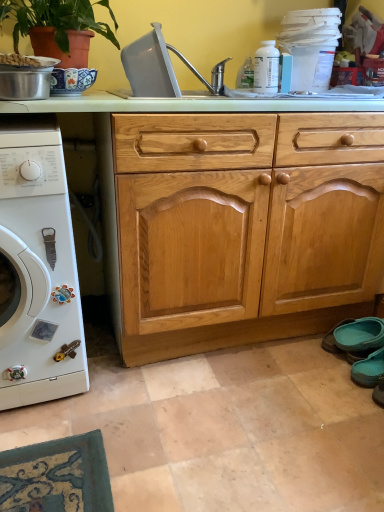
Identify the location of gray plastic sink at upper center. (211, 73).

What is the approximate height of gray plastic sink at upper center?

It is 9.87 inches.

Describe the element at coordinates (54, 20) in the screenshot. The image size is (384, 512). I see `terracotta clay pot at upper left` at that location.

In order to face metallic silver pot at upper left, should I rotate leftwards or rightwards?

To face it directly, rotate left by 22.132 degrees.

Measure the distance between teal fabric shoe at lower right, which is the 1th shoe in back-to-front order, and camera.

teal fabric shoe at lower right, which is the 1th shoe in back-to-front order, and camera are 1.52 meters apart.

In order to face teal fabric shoe at lower right, which is the 1th shoe in back-to-front order, should I rotate leftwards or rightwards?

Rotate your view right by about 24.064°.

Where is `gray plastic sink at upper center`? This screenshot has height=512, width=384. gray plastic sink at upper center is located at coordinates (211, 73).

From the image's perspective, is gray plastic sink at upper center beneath white matte washing machine at left?

Actually, gray plastic sink at upper center appears above white matte washing machine at left in the image.

Considering the relative sizes of gray plastic sink at upper center and white matte washing machine at left in the image provided, is gray plastic sink at upper center smaller than white matte washing machine at left?

Indeed, gray plastic sink at upper center has a smaller size compared to white matte washing machine at left.

Is gray plastic sink at upper center thinner than white matte washing machine at left?

Indeed, gray plastic sink at upper center has a lesser width compared to white matte washing machine at left.

Could white matte washing machine at left be considered to be inside gray plastic sink at upper center?

That's incorrect, white matte washing machine at left is not inside gray plastic sink at upper center.

Is teal fabric shoe at lower right, which is the 1th shoe in back-to-front order, located within gray plastic sink at upper center?

No, teal fabric shoe at lower right, which is the 1th shoe in back-to-front order, is not a part of gray plastic sink at upper center.

Based on the photo, is gray plastic sink at upper center looking in the opposite direction of teal fabric shoe at lower right, placed as the second shoe when sorted from front to back?

That's not correct — gray plastic sink at upper center is not looking away from teal fabric shoe at lower right, placed as the second shoe when sorted from front to back.

Identify the location of shoe that is the 2nd object located behind the gray plastic sink at upper center. Image resolution: width=384 pixels, height=512 pixels. (360, 334).

From the image's perspective, which is above, gray plastic sink at upper center or teal fabric shoe at lower right, placed as the second shoe when sorted from front to back?

From the image's view, gray plastic sink at upper center is above.

Based on their positions, is white matte washing machine at left located to the left or right of gray plastic sink at upper center?

In the image, white matte washing machine at left appears on the left side of gray plastic sink at upper center.

Can you tell me how much white matte washing machine at left and gray plastic sink at upper center differ in facing direction?

They differ by 0.00116 degrees in their facing directions.

Considering the points (43, 329) and (176, 50), which point is in front, point (43, 329) or point (176, 50)?

The point (43, 329) is closer to the camera.

Is gray plastic sink at upper center turned away from metallic silver pot at upper left?

That's not correct — gray plastic sink at upper center is not looking away from metallic silver pot at upper left.

Who is bigger, gray plastic sink at upper center or metallic silver pot at upper left?

With larger size is gray plastic sink at upper center.

Is the depth of gray plastic sink at upper center greater than that of metallic silver pot at upper left?

Yes.

This screenshot has height=512, width=384. I want to click on appliance that is above the teal fabric slipper at lower right, which is the 2th shoe in back-to-front order (from the image's perspective), so click(25, 77).

From the image's perspective, which is above, teal fabric slipper at lower right, the 1th shoe viewed from the front, or metallic silver pot at upper left?

metallic silver pot at upper left is shown above in the image.

Is teal fabric slipper at lower right, the 1th shoe viewed from the front, taller or shorter than metallic silver pot at upper left?

teal fabric slipper at lower right, the 1th shoe viewed from the front, is taller than metallic silver pot at upper left.

Consider the image. Is teal fabric slipper at lower right, the 1th shoe viewed from the front, positioned beyond the bounds of metallic silver pot at upper left?

That's correct, teal fabric slipper at lower right, the 1th shoe viewed from the front, is outside of metallic silver pot at upper left.

Can you confirm if gray plastic sink at upper center is thinner than teal fabric slipper at lower right, the 1th shoe viewed from the front?

Incorrect, the width of gray plastic sink at upper center is not less than that of teal fabric slipper at lower right, the 1th shoe viewed from the front.

Considering their positions, is gray plastic sink at upper center located in front of or behind teal fabric slipper at lower right, the 1th shoe viewed from the front?

gray plastic sink at upper center is in front of teal fabric slipper at lower right, the 1th shoe viewed from the front.

Is metallic silver pot at upper left located within teal fabric shoe at lower right, placed as the second shoe when sorted from front to back?

Actually, metallic silver pot at upper left is outside teal fabric shoe at lower right, placed as the second shoe when sorted from front to back.

I want to click on appliance on the left of teal fabric shoe at lower right, placed as the second shoe when sorted from front to back, so click(25, 77).

From the image's perspective, which object appears higher, teal fabric shoe at lower right, placed as the second shoe when sorted from front to back, or metallic silver pot at upper left?

From the image's view, metallic silver pot at upper left is above.

Is teal fabric shoe at lower right, which is the 1th shoe in back-to-front order, shorter than metallic silver pot at upper left?

No.

I want to click on sink behind the white matte washing machine at left, so click(x=211, y=73).

At what (x,y) coordinates should I click in order to perform the action: click on sink on the left side of teal fabric shoe at lower right, placed as the second shoe when sorted from front to back. Please return your answer as a coordinate pair (x, y). The height and width of the screenshot is (512, 384). Looking at the image, I should click on (211, 73).

When comparing their distances from teal fabric shoe at lower right, placed as the second shoe when sorted from front to back, does teal fabric slipper at lower right, the 1th shoe viewed from the front, or gray plastic sink at upper center seem further?

gray plastic sink at upper center.

When comparing their distances from metallic silver pot at upper left, does teal fabric slipper at lower right, the 1th shoe viewed from the front, or teal fabric shoe at lower right, placed as the second shoe when sorted from front to back, seem further?

teal fabric slipper at lower right, the 1th shoe viewed from the front, is positioned further to the anchor metallic silver pot at upper left.

When comparing their distances from terracotta clay pot at upper left, does teal fabric shoe at lower right, which is the 1th shoe in back-to-front order, or teal fabric slipper at lower right, the 1th shoe viewed from the front, seem closer?

Among the two, teal fabric shoe at lower right, which is the 1th shoe in back-to-front order, is located nearer to terracotta clay pot at upper left.

From the image, which object appears to be farther from light wood/texture drawer at center, teal fabric shoe at lower right, placed as the second shoe when sorted from front to back, or metallic silver pot at upper left?

Based on the image, teal fabric shoe at lower right, placed as the second shoe when sorted from front to back, appears to be further to light wood/texture drawer at center.

From the image, which object appears to be farther from light wood/texture drawer at center, metallic silver pot at upper left or teal fabric shoe at lower right, which is the 1th shoe in back-to-front order?

The object further to light wood/texture drawer at center is teal fabric shoe at lower right, which is the 1th shoe in back-to-front order.

Which object lies nearer to the anchor point gray plastic sink at upper center, white matte washing machine at left or light wood/texture drawer at center?

light wood/texture drawer at center is closer to gray plastic sink at upper center.

When comparing their distances from teal fabric shoe at lower right, placed as the second shoe when sorted from front to back, does metallic silver pot at upper left or terracotta clay pot at upper left seem further?

Among the two, terracotta clay pot at upper left is located further to teal fabric shoe at lower right, placed as the second shoe when sorted from front to back.

From the image, which object appears to be farther from light wood/texture drawer at center, white matte washing machine at left or teal fabric shoe at lower right, which is the 1th shoe in back-to-front order?

teal fabric shoe at lower right, which is the 1th shoe in back-to-front order, lies further to light wood/texture drawer at center than the other object.

Locate an element on the screen. Image resolution: width=384 pixels, height=512 pixels. houseplant between white matte washing machine at left and teal fabric slipper at lower right, which is the 2th shoe in back-to-front order, from left to right is located at coordinates pyautogui.click(x=54, y=20).

You are a GUI agent. You are given a task and a screenshot of the screen. Output one action in this format:
    pyautogui.click(x=<x>, y=<y>)
    Task: Click on the sink between white matte washing machine at left and light wood/texture drawer at center
    This screenshot has width=384, height=512.
    Given the screenshot: What is the action you would take?
    pyautogui.click(x=211, y=73)

What are the coordinates of `shoe between white matte washing machine at left and teal fabric shoe at lower right, placed as the second shoe when sorted from front to back, in the horizontal direction` in the screenshot? It's located at (369, 369).

The height and width of the screenshot is (512, 384). I want to click on shoe situated between terracotta clay pot at upper left and teal fabric shoe at lower right, which is the 1th shoe in back-to-front order, from left to right, so click(369, 369).